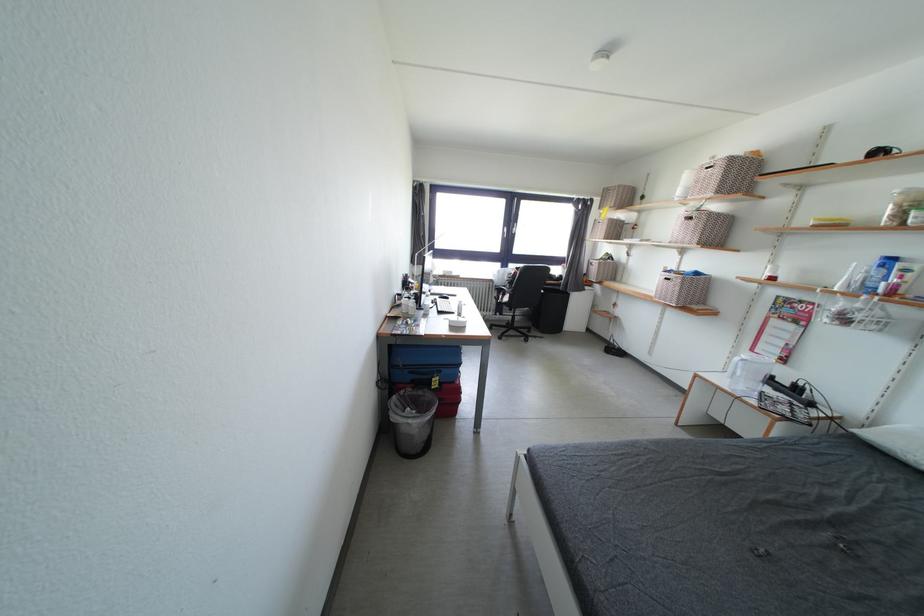
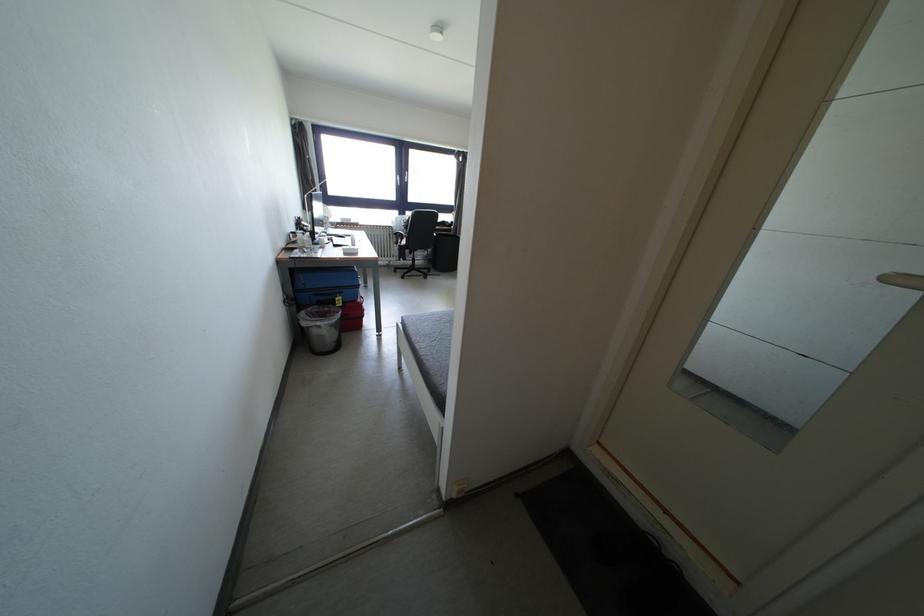
In the second image, find the point that corresponds to (444,373) in the first image.

(345, 294)